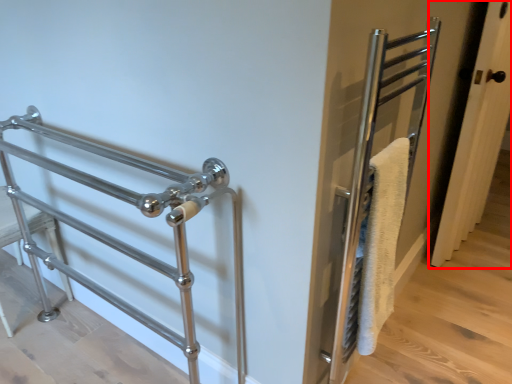
Question: From the image's perspective, considering the relative positions of door (annotated by the red box) and steel in the image provided, where is door (annotated by the red box) located with respect to the staircase?

Choices:
 (A) above
 (B) below

Answer: (A)